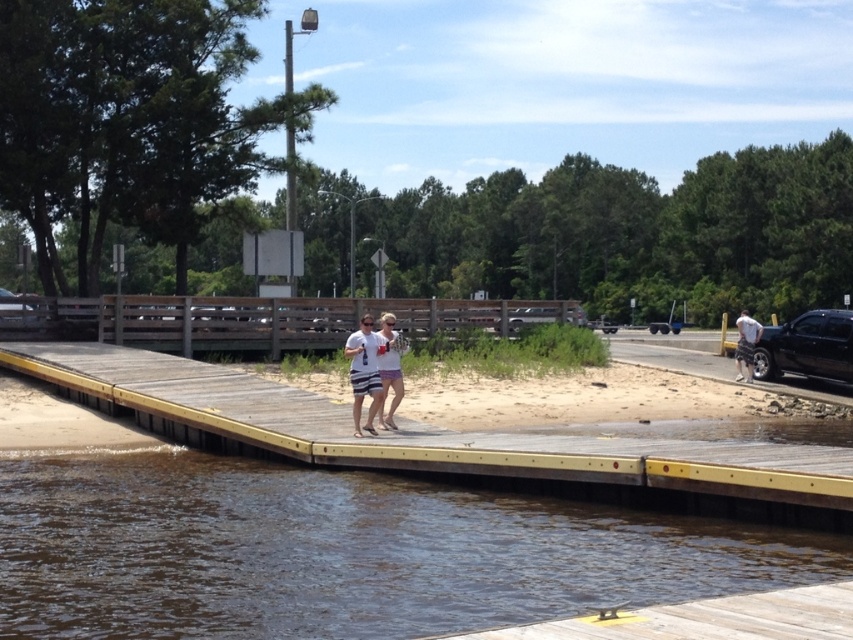
Looking at this image, you are standing on the wooden dock and want to locate the brown water at lower left. According to the coordinates provided, what are the exact coordinates where you should look to find it?

The brown water at lower left is located at the coordinates point (344, 552).

You are a photographer trying to capture the wooden dock at center and the black glossy truck at right in a single frame. Which object will appear narrower in your photo?

The wooden dock at center will appear narrower in the photo because it is thinner than the black glossy truck at right.

You are standing on the wooden dock with a yellow border and want to walk towards the point closer to the water. Which point should you head towards, point (x=357, y=458) or point (x=840, y=314)?

You should head towards point (x=357, y=458) because it is in front of point (x=840, y=314), meaning it is closer to the water.